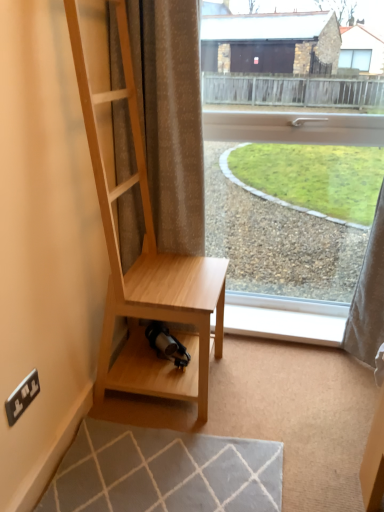
Where is `vacant space in front of light wood shelf at center`? vacant space in front of light wood shelf at center is located at coordinates (157, 454).